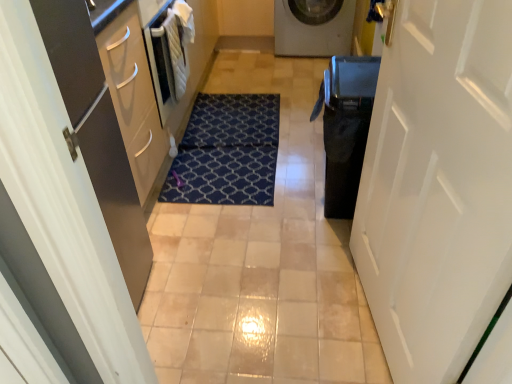
I want to click on vacant area that is in front of blue patterned mat at center, so click(243, 253).